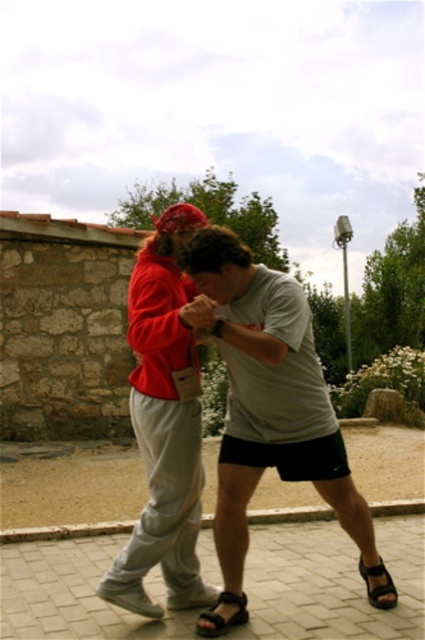
Between gray cotton t-shirt at center and matte red hoodie at center, which one has less height?

gray cotton t-shirt at center is shorter.

Does gray cotton t-shirt at center appear on the right side of matte red hoodie at center?

Yes, gray cotton t-shirt at center is to the right of matte red hoodie at center.

Find the location of `gray cotton t-shirt at center`. gray cotton t-shirt at center is located at coordinates (269, 397).

Does gray cotton t-shirt at center appear under black leather sandal at lower right?

Actually, gray cotton t-shirt at center is above black leather sandal at lower right.

Is point (283, 296) closer to viewer compared to point (368, 568)?

That is True.

The height and width of the screenshot is (640, 425). Describe the element at coordinates (269, 397) in the screenshot. I see `gray cotton t-shirt at center` at that location.

Image resolution: width=425 pixels, height=640 pixels. Find the location of `gray cotton t-shirt at center`. gray cotton t-shirt at center is located at coordinates (269, 397).

Can you confirm if black leather sandal at lower center is positioned to the right of black leather sandal at lower right?

No, black leather sandal at lower center is not to the right of black leather sandal at lower right.

How far apart are black leather sandal at lower center and black leather sandal at lower right?

The distance of black leather sandal at lower center from black leather sandal at lower right is 89.69 centimeters.

Is point (223, 596) less distant than point (384, 592)?

Yes, point (223, 596) is closer to viewer.

Find the location of a particular element. The width and height of the screenshot is (425, 640). black leather sandal at lower center is located at coordinates (221, 616).